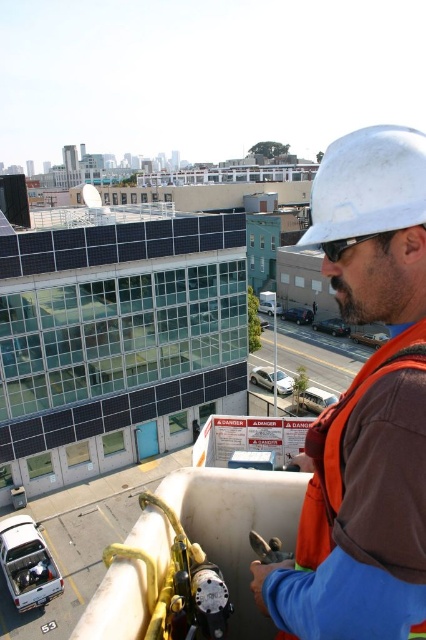
You are a safety inspector reviewing the rooftop scene. You notice two hard hats labeled as white hard hat at upper right and white matte hard hat at upper right. According to safety protocols, only one hard hat should be worn at a time. Which hard hat is actually being worn by the worker?

The white hard hat at upper right is positioned under the white matte hard hat at upper right, indicating that the white matte hard hat at upper right is the one being worn by the worker.

In the scene shown: You are a construction supervisor checking the rooftop layout. You need to locate the white hard hat at upper right. According to the coordinates provided, where exactly is it positioned?

The white hard hat at upper right is located at point coordinates 0.639 in the x axis and 0.859 in the y axis.

You are a construction supervisor checking safety protocols. You notice a worker at point [365,408]. What object is located at that coordinate?

The point [365,408] corresponds to the white hard hat at upper right.